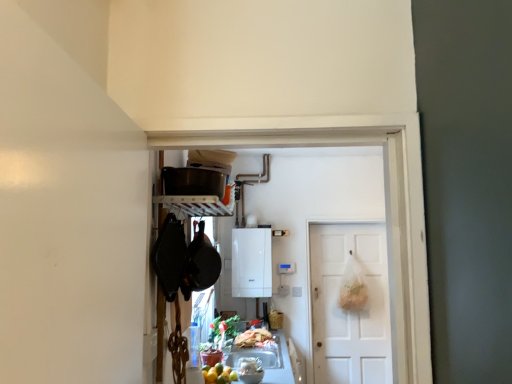
Measure the distance between white glossy countertop at lower center and camera.

white glossy countertop at lower center and camera are 2.42 meters apart from each other.

Where is `matte black pot at upper center`? The height and width of the screenshot is (384, 512). matte black pot at upper center is located at coordinates (192, 181).

Image resolution: width=512 pixels, height=384 pixels. Describe the element at coordinates (251, 262) in the screenshot. I see `white glossy boiler at center` at that location.

Measure the distance between white glossy boiler at center and camera.

The distance of white glossy boiler at center from camera is 3.85 meters.

Where is `white matte door at center`? white matte door at center is located at coordinates (350, 311).

How different are the orientations of matte black pot at upper center and white glossy countertop at lower center in degrees?

They differ by 1.96 degrees in their facing directions.

Relative to white glossy countertop at lower center, is matte black pot at upper center in front or behind?

Clearly, matte black pot at upper center is in front of white glossy countertop at lower center.

Which is more to the left, matte black pot at upper center or white glossy countertop at lower center?

From the viewer's perspective, matte black pot at upper center appears more on the left side.

Who is smaller, matte black pot at upper center or white glossy countertop at lower center?

matte black pot at upper center is smaller.

Which is in front, point (365, 312) or point (175, 175)?

Point (175, 175)

Considering the sizes of white matte door at center and matte black pot at upper center in the image, is white matte door at center wider or thinner than matte black pot at upper center?

In the image, white matte door at center appears to be more narrow than matte black pot at upper center.

Visually, is white matte door at center positioned to the left or to the right of matte black pot at upper center?

Clearly, white matte door at center is on the right of matte black pot at upper center in the image.

From the image's perspective, which is below, white matte door at center or matte black pot at upper center?

white matte door at center is shown below in the image.

From the image's perspective, does matte black pot at upper center appear lower than white matte door at center?

No, from the image's perspective, matte black pot at upper center is not beneath white matte door at center.

Considering the relative positions of matte black pot at upper center and white matte door at center in the image provided, is matte black pot at upper center to the right of white matte door at center from the viewer's perspective?

No.

Would you consider matte black pot at upper center to be distant from white matte door at center?

That's right, there is a large distance between matte black pot at upper center and white matte door at center.

Which of these two, matte black pot at upper center or white matte door at center, is smaller?

Smaller between the two is matte black pot at upper center.

Is white matte door at center facing towards white glossy boiler at center?

No, white matte door at center is not facing towards white glossy boiler at center.

Considering the relative positions of white matte door at center and white glossy boiler at center in the image provided, is white matte door at center to the left or to the right of white glossy boiler at center?

In the image, white matte door at center appears on the right side of white glossy boiler at center.

Which is closer to the camera, (x=352, y=342) or (x=242, y=228)?

Point (x=352, y=342) is positioned farther from the camera compared to point (x=242, y=228).

From a real-world perspective, is white glossy countertop at lower center positioned above or below shiny plastic bag of food at lower center?

Clearly, from a real-world perspective, white glossy countertop at lower center is below shiny plastic bag of food at lower center.

Is white glossy countertop at lower center bigger or smaller than shiny plastic bag of food at lower center?

white glossy countertop at lower center is bigger than shiny plastic bag of food at lower center.

Between white glossy countertop at lower center and shiny plastic bag of food at lower center, which one has more height?

white glossy countertop at lower center.

Is matte black pot at upper center located within white glossy boiler at center?

Actually, matte black pot at upper center is outside white glossy boiler at center.

Considering the sizes of objects white glossy boiler at center and matte black pot at upper center in the image provided, who is shorter, white glossy boiler at center or matte black pot at upper center?

With less height is matte black pot at upper center.

Does white glossy boiler at center turn towards matte black pot at upper center?

Yes, white glossy boiler at center is aimed at matte black pot at upper center.

Considering their positions, is white glossy countertop at lower center located in front of or behind white matte door at center?

Visually, white glossy countertop at lower center is located in front of white matte door at center.

Is white glossy countertop at lower center outside of white matte door at center?

Yes.

Would you say white glossy countertop at lower center is a long distance from white matte door at center?

No.

Image resolution: width=512 pixels, height=384 pixels. Find the location of `kitchen appliance on the left of the white glossy countertop at lower center`. kitchen appliance on the left of the white glossy countertop at lower center is located at coordinates (192, 181).

The height and width of the screenshot is (384, 512). In the image, there is a matte black pot at upper center. Find the location of `door below it (from the image's perspective)`. door below it (from the image's perspective) is located at coordinates (350, 311).

When comparing their distances from white matte door at center, does matte black pot at upper center or white glossy countertop at lower center seem closer?

white glossy countertop at lower center is closer to white matte door at center.

Considering their positions, is white glossy boiler at center positioned further to white glossy countertop at lower center than shiny plastic bag of food at lower center?

white glossy boiler at center is further to white glossy countertop at lower center.

Estimate the real-world distances between objects in this image. Which object is closer to white glossy countertop at lower center, shiny plastic bag of food at lower center or white glossy boiler at center?

Based on the image, shiny plastic bag of food at lower center appears to be nearer to white glossy countertop at lower center.

When comparing their distances from white glossy countertop at lower center, does shiny plastic bag of food at lower center or white matte door at center seem further?

white matte door at center lies further to white glossy countertop at lower center than the other object.

Estimate the real-world distances between objects in this image. Which object is further from white matte door at center, white glossy boiler at center or shiny plastic bag of food at lower center?

The object further to white matte door at center is shiny plastic bag of food at lower center.

Estimate the real-world distances between objects in this image. Which object is further from white glossy boiler at center, matte black pot at upper center or white glossy countertop at lower center?

matte black pot at upper center is further to white glossy boiler at center.

Consider the image. Considering their positions, is white matte door at center positioned further to white glossy countertop at lower center than shiny plastic bag of food at lower center?

white matte door at center lies further to white glossy countertop at lower center than the other object.

From the image, which object appears to be nearer to white matte door at center, shiny plastic bag of food at lower center or white glossy boiler at center?

white glossy boiler at center lies closer to white matte door at center than the other object.

Where is `food between white glossy countertop at lower center and white glossy boiler at center from front to back`? The height and width of the screenshot is (384, 512). food between white glossy countertop at lower center and white glossy boiler at center from front to back is located at coordinates (253, 338).

Locate an element on the screen. food between white glossy countertop at lower center and white matte door at center from front to back is located at coordinates click(x=253, y=338).

Identify the location of food situated between white glossy boiler at center and white matte door at center from left to right. This screenshot has width=512, height=384. click(253, 338).

Identify the location of food between matte black pot at upper center and white matte door at center from front to back. The width and height of the screenshot is (512, 384). (253, 338).